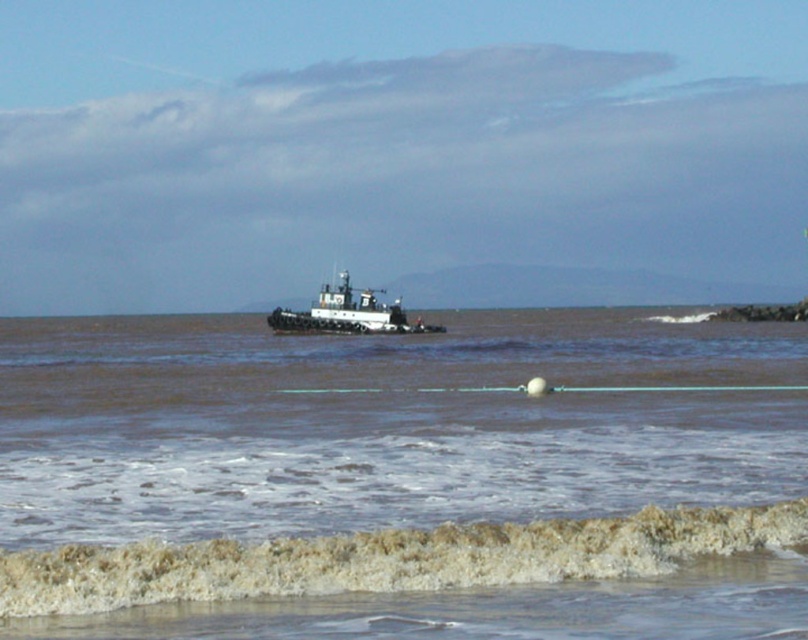
You are standing on the beach looking at the coastal scene. There is a point marked at coordinates [386,557]. What does this point represent in the scene?

The point at [386,557] represents the frothy white foam at lower center.

You are a photographer trying to capture the entire white matte tugboat at center and brown matte water at center in one frame. Based on the scene, which object would require you to adjust your camera angle to ensure both are fully visible?

The brown matte water at center is wider than the white matte tugboat at center, so you may need to adjust your camera angle to accommodate its greater width to ensure both are fully visible.

You are a surfer planning to paddle out to the open water. You need to cross both the brown matte water at center and the frothy white foam at lower center. Which path should you choose to reach the open water more quickly, and why?

You should choose the brown matte water at center because its width is larger than the frothy white foam at lower center, allowing for a more direct path towards the open water.